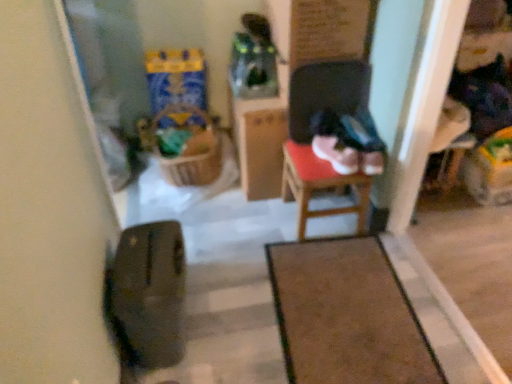
You are a GUI agent. You are given a task and a screenshot of the screen. Output one action in this format:
    pyautogui.click(x=<x>, y=<y>)
    Task: Click on the free space between brown carpet at center and transparent glass door at left
    This screenshot has height=384, width=512.
    Given the screenshot: What is the action you would take?
    [x=232, y=256]